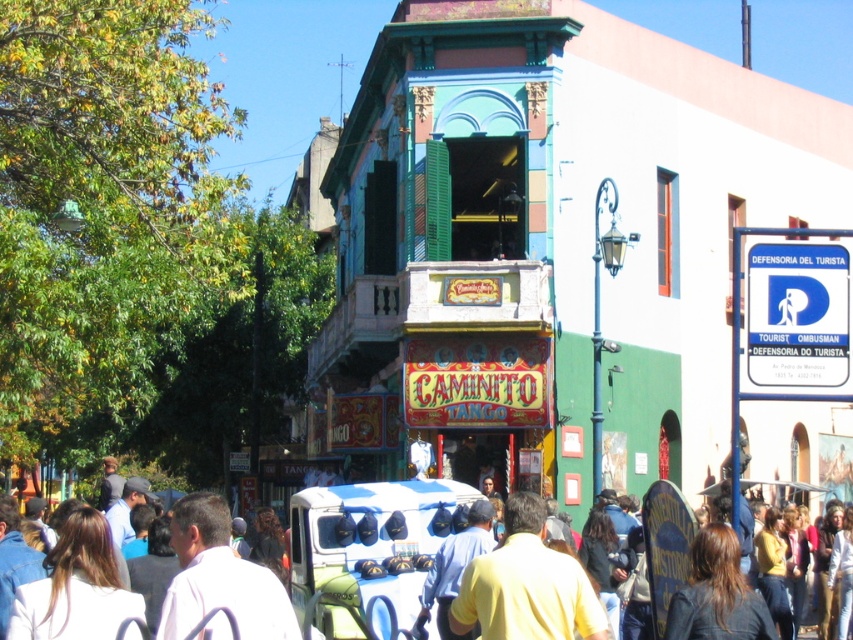
Question: Does white matte shirt at center appear over yellow cotton shirt at center?

Choices:
 (A) no
 (B) yes

Answer: (B)

Question: Does yellow matte shirt at center lie behind white fabric backpack at lower left?

Choices:
 (A) no
 (B) yes

Answer: (B)

Question: Estimate the real-world distances between objects in this image. Which object is closer to the yellow matte shirt at center?

Choices:
 (A) white fabric backpack at lower left
 (B) white matte shirt at center
 (C) yellow cotton shirt at center

Answer: (C)

Question: Which object is farther from the camera taking this photo?

Choices:
 (A) yellow cotton shirt at center
 (B) white matte shirt at center
 (C) white fabric backpack at lower left
 (D) yellow matte shirt at center

Answer: (D)

Question: Which point is closer to the camera taking this photo?

Choices:
 (A) (672, 538)
 (B) (216, 548)

Answer: (B)

Question: Does yellow matte shirt at center have a larger size compared to white fabric backpack at lower left?

Choices:
 (A) no
 (B) yes

Answer: (A)